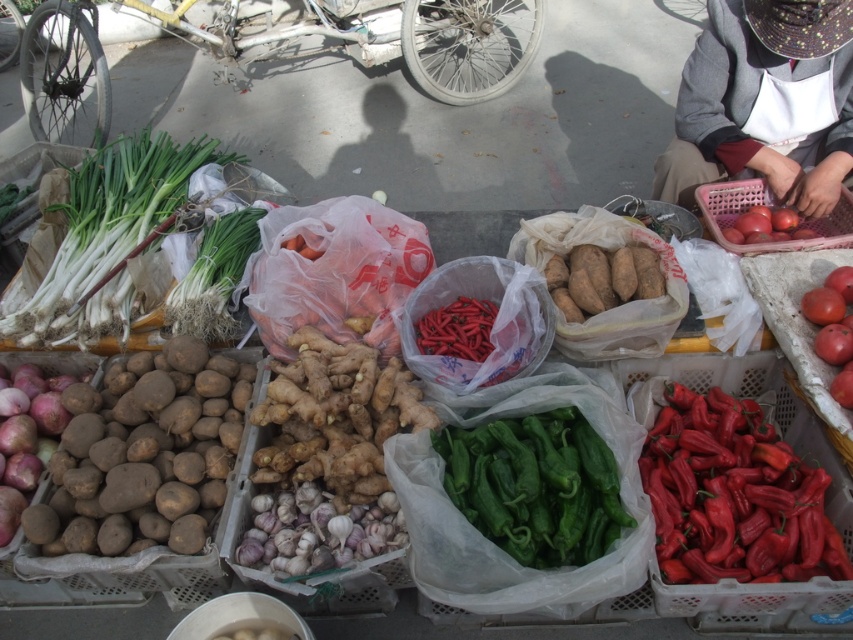
In the scene shown: You are a vendor at the market and want to place both the green plastic bag at upper center and the red matte tomato at center right on a shelf. The shelf has a maximum width of 1 meter. Can you fit both items side by side without exceeding the shelf width?

Answer: The green plastic bag at upper center is wider than the red matte tomato at center right. However, since the total width of both items combined is not provided, we cannot determine if they will fit on the 1 meter shelf. More information is needed.

You are a customer at the market and want to reach the white cotton apron at upper right to ask the vendor a question. However, you notice the green plastic bag at upper center is blocking your path. Can you walk around it to get to the apron without moving the bag?

The green plastic bag at upper center is further to the viewer than the white cotton apron at upper right, so you can walk around it to reach the apron without moving the bag.